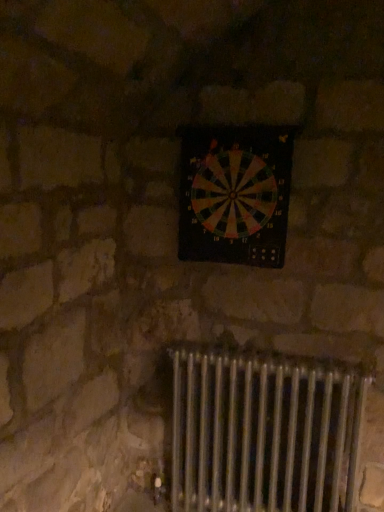
Question: Is multicolored plastic dartboard at center inside the boundaries of metallic radiator at lower center, or outside?

Choices:
 (A) outside
 (B) inside

Answer: (A)

Question: Visually, is multicolored plastic dartboard at center positioned to the left or to the right of metallic radiator at lower center?

Choices:
 (A) right
 (B) left

Answer: (B)

Question: Is point (266, 266) positioned closer to the camera than point (294, 481)?

Choices:
 (A) farther
 (B) closer

Answer: (B)

Question: From a real-world perspective, is metallic radiator at lower center positioned above or below multicolored plastic dartboard at center?

Choices:
 (A) above
 (B) below

Answer: (B)

Question: Looking at their shapes, would you say metallic radiator at lower center is wider or thinner than multicolored plastic dartboard at center?

Choices:
 (A) thin
 (B) wide

Answer: (B)

Question: In terms of height, does metallic radiator at lower center look taller or shorter compared to multicolored plastic dartboard at center?

Choices:
 (A) tall
 (B) short

Answer: (A)

Question: Considering their positions, is metallic radiator at lower center located in front of or behind multicolored plastic dartboard at center?

Choices:
 (A) behind
 (B) front

Answer: (B)